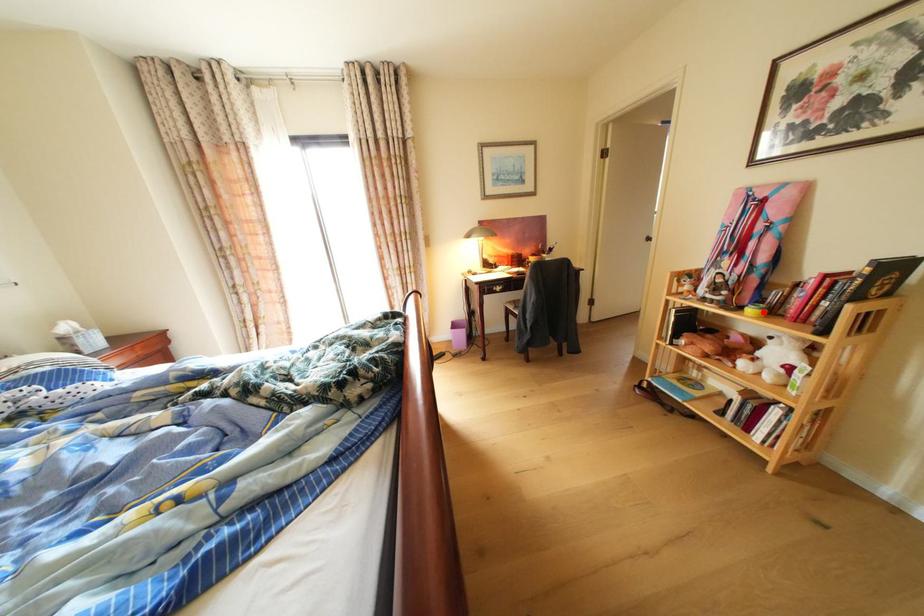
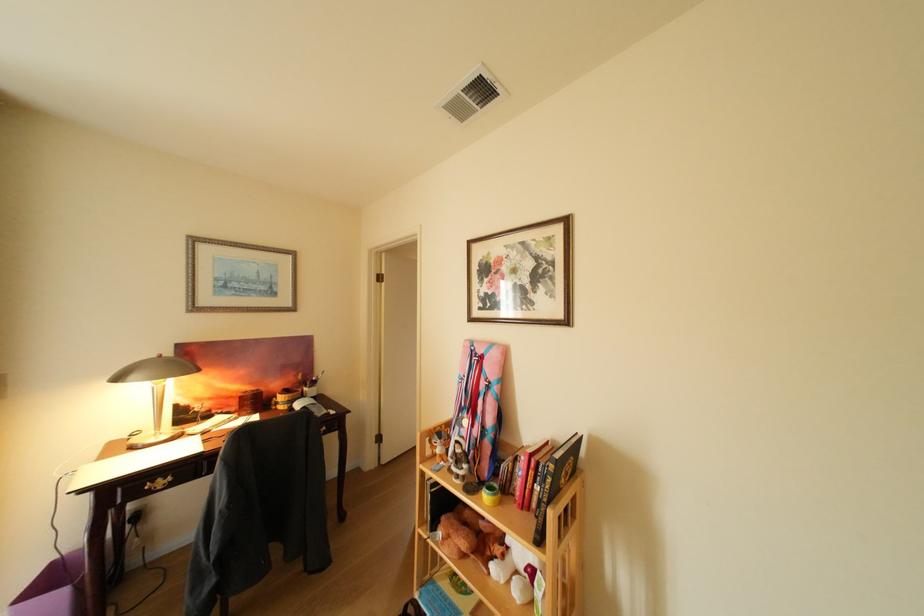
In the second image, find the point that corresponds to the highlighted location in the first image.

(499, 499)